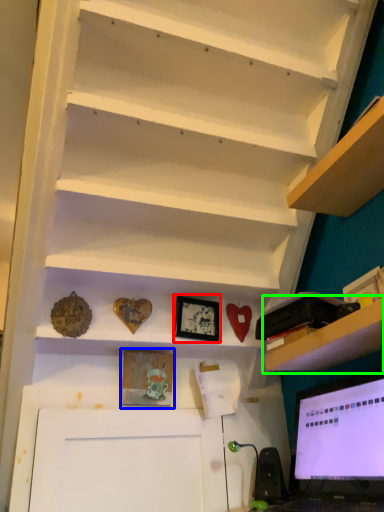
Question: Which is farther away from picture frame (highlighted by a red box)? picture frame (highlighted by a blue box) or shelf (highlighted by a green box)?

Choices:
 (A) picture frame
 (B) shelf

Answer: (B)